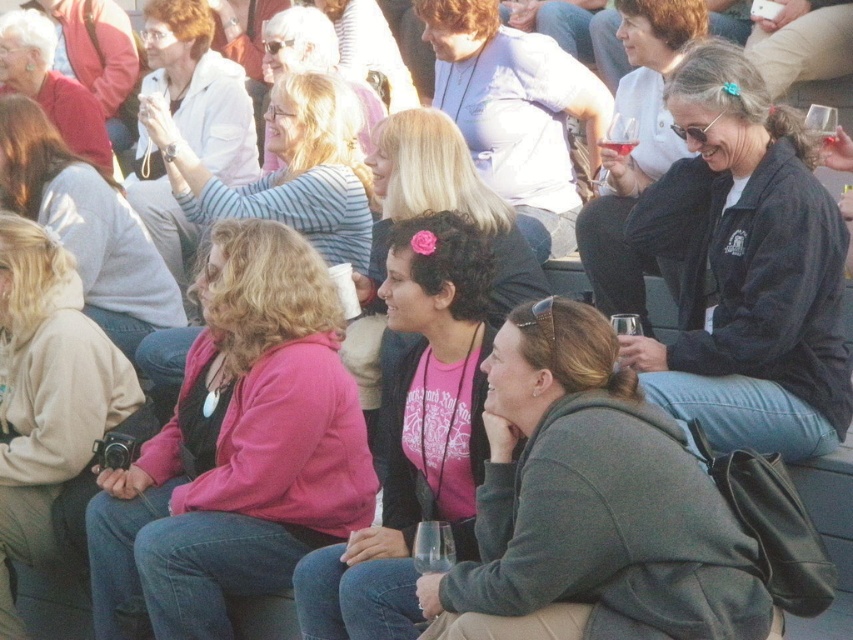
Question: Does pink fabric shirt at center come behind matte black jacket at upper left?

Choices:
 (A) yes
 (B) no

Answer: (B)

Question: Which point appears closest to the camera in this image?

Choices:
 (A) (473, 477)
 (B) (608, 628)

Answer: (B)

Question: Based on their relative distances, which object is nearer to the matte black jacket at center?

Choices:
 (A) beige fleece sweatshirt at lower left
 (B) matte black jacket at upper left

Answer: (A)

Question: Is beige fleece sweatshirt at lower left bigger than matte black jacket at center?

Choices:
 (A) yes
 (B) no

Answer: (B)

Question: Which is nearer to the pink fleece jacket at center?

Choices:
 (A) pink fabric shirt at center
 (B) beige fleece sweatshirt at lower left
 (C) clear glass wine at center
 (D) gray hoodie at center

Answer: (A)

Question: From the image, what is the correct spatial relationship of pink fleece jacket at center in relation to light gray hoodie at center?

Choices:
 (A) above
 (B) below

Answer: (B)